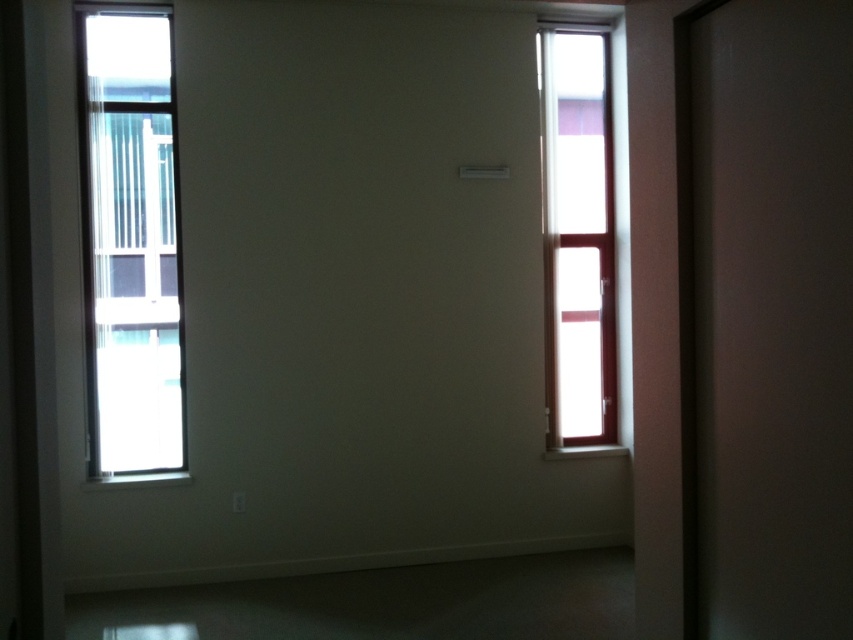
Which is above, transparent glass screen door at right or clear glass window at left?

clear glass window at left is above.

Between transparent glass screen door at right and clear glass window at left, which one appears on the left side from the viewer's perspective?

Positioned to the left is clear glass window at left.

You are a GUI agent. You are given a task and a screenshot of the screen. Output one action in this format:
    pyautogui.click(x=<x>, y=<y>)
    Task: Click on the transparent glass screen door at right
    
    Given the screenshot: What is the action you would take?
    pyautogui.click(x=770, y=321)

In the scene shown: Does transparent glass screen door at right appear over clear glass window at right?

No.

How distant is transparent glass screen door at right from clear glass window at right?

A distance of 3.14 meters exists between transparent glass screen door at right and clear glass window at right.

The width and height of the screenshot is (853, 640). What do you see at coordinates (770, 321) in the screenshot? I see `transparent glass screen door at right` at bounding box center [770, 321].

Identify the location of transparent glass screen door at right. The width and height of the screenshot is (853, 640). (770, 321).

Does clear glass window at left appear on the left side of clear glass window at right?

Correct, you'll find clear glass window at left to the left of clear glass window at right.

Between point (144, 33) and point (595, 209), which one is positioned in front?

Point (144, 33) is more forward.

Is point (155, 42) positioned after point (578, 403)?

No, (155, 42) is closer to viewer.

You are a GUI agent. You are given a task and a screenshot of the screen. Output one action in this format:
    pyautogui.click(x=<x>, y=<y>)
    Task: Click on the clear glass window at left
    The image size is (853, 640).
    Given the screenshot: What is the action you would take?
    pyautogui.click(x=131, y=241)